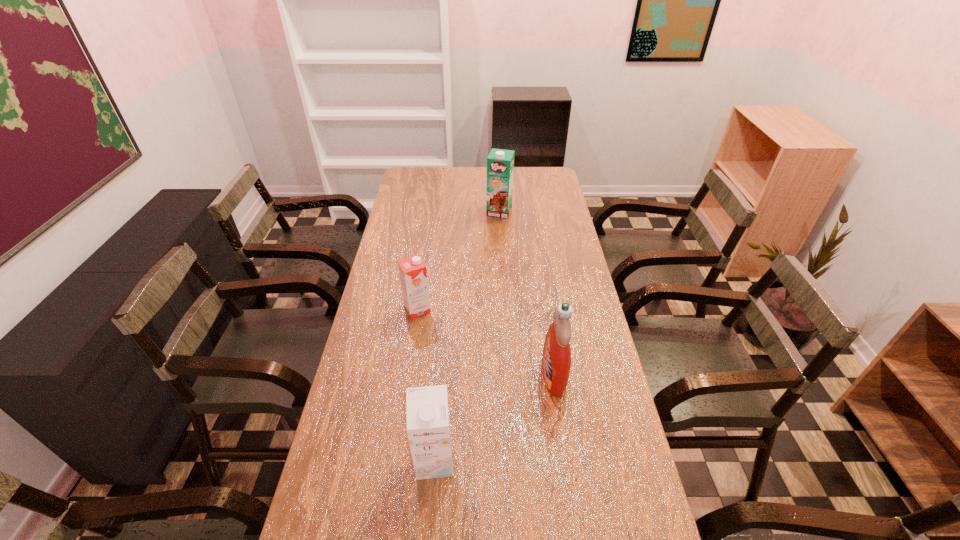
Where is `free space between the rightmost carton and the second object from left to right`? free space between the rightmost carton and the second object from left to right is located at coordinates (467, 336).

Identify which object is located as the nearest to the nearest object. Please provide its 2D coordinates. Your answer should be formatted as a tuple, i.e. [(x, y)], where the tuple contains the x and y coordinates of a point satisfying the conditions above.

[(556, 360)]

Locate which object is the third closest to the detergent. Please provide its 2D coordinates. Your answer should be formatted as a tuple, i.e. [(x, y)], where the tuple contains the x and y coordinates of a point satisfying the conditions above.

[(500, 163)]

Locate which carton ranks second in proximity to the second object from right to left. Please provide its 2D coordinates. Your answer should be formatted as a tuple, i.e. [(x, y)], where the tuple contains the x and y coordinates of a point satisfying the conditions above.

[(427, 414)]

Identify which carton is located as the third nearest to the rightmost object. Please provide its 2D coordinates. Your answer should be formatted as a tuple, i.e. [(x, y)], where the tuple contains the x and y coordinates of a point satisfying the conditions above.

[(500, 163)]

You are a GUI agent. You are given a task and a screenshot of the screen. Output one action in this format:
    pyautogui.click(x=<x>, y=<y>)
    Task: Click on the vacant space that satisfies the following two spatial constraints: 1. on the back side of the farthest carton; 2. on the left side of the second carton from right to left
    The height and width of the screenshot is (540, 960).
    Given the screenshot: What is the action you would take?
    pyautogui.click(x=454, y=211)

Where is `vacant space that satisfies the following two spatial constraints: 1. on the front side of the leftmost carton; 2. on the right side of the second carton from left to right`? vacant space that satisfies the following two spatial constraints: 1. on the front side of the leftmost carton; 2. on the right side of the second carton from left to right is located at coordinates (395, 461).